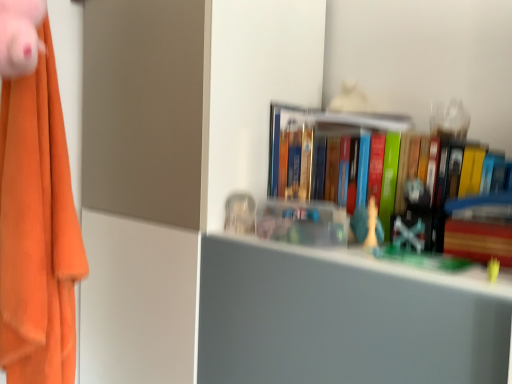
Question: Would you consider white plastic chess piece at center, which is the third toy in left-to-right order, to be distant from clear plastic container at center, the 2th toy from the top?

Choices:
 (A) yes
 (B) no

Answer: (B)

Question: Considering the relative sizes of white plastic chess piece at center, the 2th toy positioned from the front, and clear plastic container at center, acting as the 1th toy starting from the back, in the image provided, is white plastic chess piece at center, the 2th toy positioned from the front, thinner than clear plastic container at center, acting as the 1th toy starting from the back,?

Choices:
 (A) yes
 (B) no

Answer: (A)

Question: Does white plastic chess piece at center, the 2th toy positioned from the front, appear on the left side of clear plastic container at center, the second toy when ordered from right to left?

Choices:
 (A) no
 (B) yes

Answer: (A)

Question: Is white plastic chess piece at center, placed as the first toy when sorted from bottom to top, looking in the opposite direction of clear plastic container at center, arranged as the 2th toy when viewed from the left?

Choices:
 (A) no
 (B) yes

Answer: (A)

Question: Can clear plastic container at center, placed as the second toy when sorted from bottom to top, be found inside white plastic chess piece at center, the 2th toy viewed from the back?

Choices:
 (A) no
 (B) yes

Answer: (A)

Question: Looking at their shapes, would you say clear plastic container at center, arranged as the 2th toy when viewed from the left, is wider or thinner than wooden paperback book at right?

Choices:
 (A) thin
 (B) wide

Answer: (A)

Question: From a real-world perspective, relative to wooden paperback book at right, is clear plastic container at center, the second toy when ordered from right to left, vertically above or below?

Choices:
 (A) above
 (B) below

Answer: (A)

Question: Based on their positions, is clear plastic container at center, arranged as the 2th toy when viewed from the left, located to the left or right of wooden paperback book at right?

Choices:
 (A) right
 (B) left

Answer: (B)

Question: Is clear plastic container at center, marked as the 3th toy in a front-to-back arrangement, taller or shorter than wooden paperback book at right?

Choices:
 (A) tall
 (B) short

Answer: (A)

Question: Relative to pink plush toy at upper left, the third toy when ordered from right to left, is wooden paperback book at right in front or behind?

Choices:
 (A) front
 (B) behind

Answer: (B)

Question: Is point (495, 238) positioned closer to the camera than point (40, 1)?

Choices:
 (A) farther
 (B) closer

Answer: (B)

Question: In terms of width, does wooden paperback book at right look wider or thinner when compared to pink plush toy at upper left, the third toy when ordered from right to left?

Choices:
 (A) wide
 (B) thin

Answer: (A)

Question: Visually, is wooden paperback book at right positioned to the left or to the right of pink plush toy at upper left, marked as the 3th toy in a back-to-front arrangement?

Choices:
 (A) left
 (B) right

Answer: (B)

Question: In terms of width, does orange fabric at left look wider or thinner when compared to clear plastic container at center, the second toy when ordered from right to left?

Choices:
 (A) wide
 (B) thin

Answer: (A)

Question: Is orange fabric at left in front of or behind clear plastic container at center, acting as the 1th toy starting from the back, in the image?

Choices:
 (A) behind
 (B) front

Answer: (B)